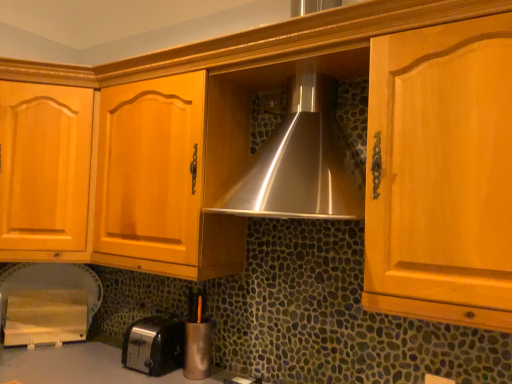
Question: Considering the relative positions of wooden cutting board at lower left, which is counted as the 1th appliance, starting from the left, and satin black toaster at lower left in the image provided, is wooden cutting board at lower left, which is counted as the 1th appliance, starting from the left, to the right of satin black toaster at lower left from the viewer's perspective?

Choices:
 (A) no
 (B) yes

Answer: (A)

Question: Could satin black toaster at lower left be considered to be inside wooden cutting board at lower left, arranged as the first appliance when viewed from the back?

Choices:
 (A) no
 (B) yes

Answer: (A)

Question: Is wooden cutting board at lower left, which is counted as the second appliance, starting from the front, not close to satin black toaster at lower left?

Choices:
 (A) yes
 (B) no

Answer: (B)

Question: Is wooden cutting board at lower left, the second appliance positioned from the right, wider than satin black toaster at lower left?

Choices:
 (A) no
 (B) yes

Answer: (A)

Question: Can we say wooden cutting board at lower left, arranged as the first appliance when viewed from the back, lies outside satin black toaster at lower left?

Choices:
 (A) no
 (B) yes

Answer: (B)

Question: From the image's perspective, does wooden cutting board at lower left, arranged as the first appliance when viewed from the back, appear lower than satin black toaster at lower left?

Choices:
 (A) no
 (B) yes

Answer: (A)

Question: From the image's perspective, is wooden cutting board at lower left, the second appliance positioned from the right, under metallic silver pen holder at lower center, the first appliance viewed from the right?

Choices:
 (A) yes
 (B) no

Answer: (B)

Question: Are wooden cutting board at lower left, which is counted as the second appliance, starting from the front, and metallic silver pen holder at lower center, the 1th appliance viewed from the front, located far from each other?

Choices:
 (A) no
 (B) yes

Answer: (A)

Question: Does wooden cutting board at lower left, which is counted as the 1th appliance, starting from the left, appear on the left side of metallic silver pen holder at lower center, the first appliance viewed from the right?

Choices:
 (A) no
 (B) yes

Answer: (B)

Question: Does wooden cutting board at lower left, the second appliance positioned from the right, appear on the right side of metallic silver pen holder at lower center, the 1th appliance viewed from the front?

Choices:
 (A) no
 (B) yes

Answer: (A)

Question: Considering the relative sizes of wooden cutting board at lower left, the second appliance positioned from the right, and metallic silver pen holder at lower center, which is the second appliance in back-to-front order, in the image provided, is wooden cutting board at lower left, the second appliance positioned from the right, shorter than metallic silver pen holder at lower center, which is the second appliance in back-to-front order,?

Choices:
 (A) yes
 (B) no

Answer: (A)

Question: Is wooden cutting board at lower left, which is counted as the 1th appliance, starting from the left, located outside metallic silver pen holder at lower center, which ranks as the second appliance in left-to-right order?

Choices:
 (A) no
 (B) yes

Answer: (B)

Question: Is the position of metallic silver pen holder at lower center, which is the second appliance in back-to-front order, more distant than that of satin black toaster at lower left?

Choices:
 (A) no
 (B) yes

Answer: (B)